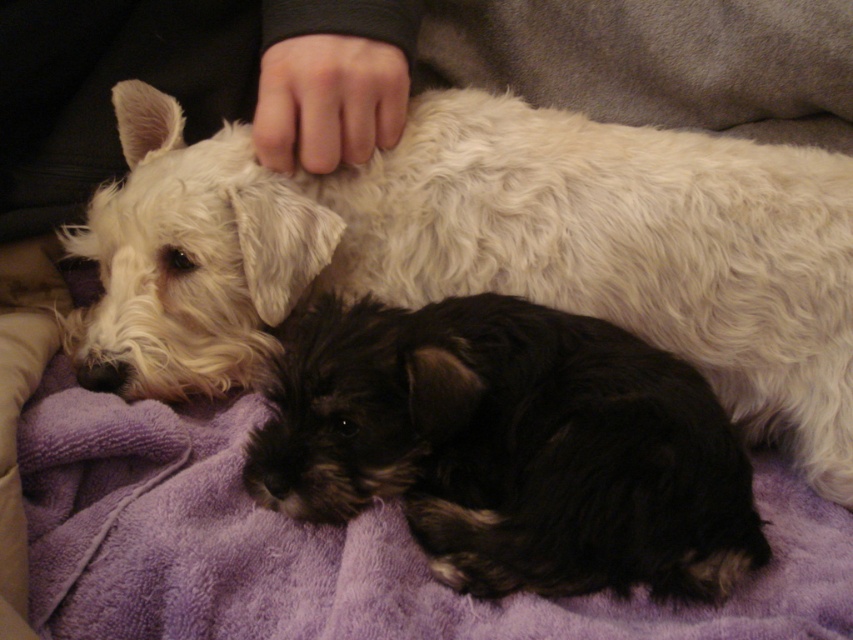
Looking at this image, which of these two, white fluffy dog at upper left or black shaggy dog at center, stands shorter?

Standing shorter between the two is black shaggy dog at center.

Can you confirm if white fluffy dog at upper left is positioned to the right of black shaggy dog at center?

Incorrect, white fluffy dog at upper left is not on the right side of black shaggy dog at center.

What do you see at coordinates (486, 250) in the screenshot? I see `white fluffy dog at upper left` at bounding box center [486, 250].

Where is `white fluffy dog at upper left`? white fluffy dog at upper left is located at coordinates (486, 250).